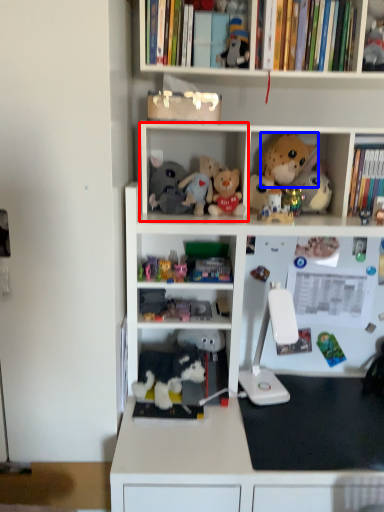
Question: Which object appears closest to the camera in this image, cabinet (highlighted by a red box) or toy (highlighted by a blue box)?

Choices:
 (A) cabinet
 (B) toy

Answer: (A)